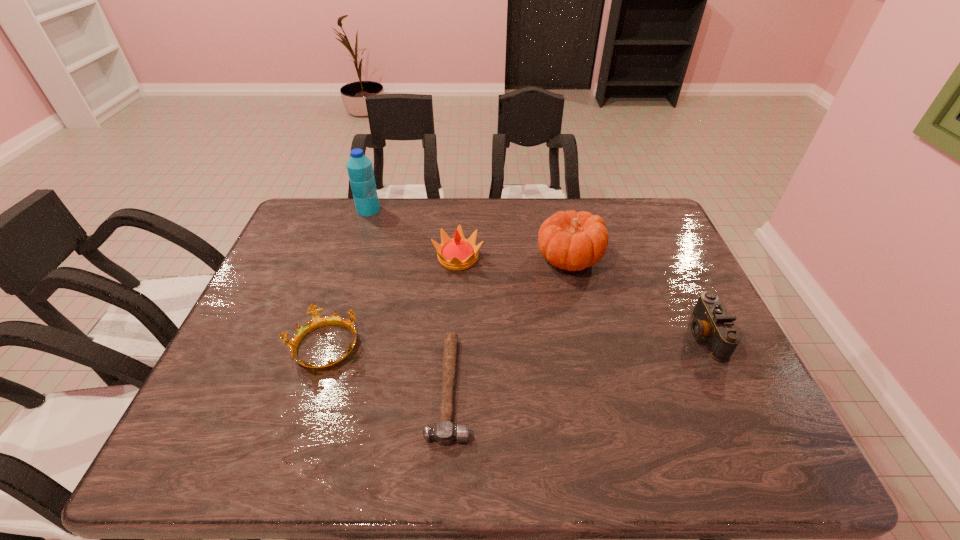
Locate an element on the screen. Image resolution: width=960 pixels, height=540 pixels. pumpkin that is at the far edge is located at coordinates (573, 241).

The height and width of the screenshot is (540, 960). I want to click on object at the near edge, so click(444, 432).

This screenshot has width=960, height=540. I want to click on object present at the left edge, so pyautogui.click(x=317, y=321).

Identify the location of object at the right edge. (711, 321).

Identify the location of vacant space at the far edge of the desktop. This screenshot has width=960, height=540. (477, 234).

Locate an element on the screen. This screenshot has height=540, width=960. vacant area at the near edge is located at coordinates (643, 460).

You are a GUI agent. You are given a task and a screenshot of the screen. Output one action in this format:
    pyautogui.click(x=<x>, y=<y>)
    Task: Click on the vacant space at the right edge of the desktop
    The width and height of the screenshot is (960, 540).
    Given the screenshot: What is the action you would take?
    pyautogui.click(x=700, y=371)

In the image, there is a desktop. At what (x,y) coordinates should I click in order to perform the action: click on vacant space at the near left corner. Please return your answer as a coordinate pair (x, y). Looking at the image, I should click on (209, 460).

In the image, there is a desktop. Where is `free space at the far right corner`? The image size is (960, 540). free space at the far right corner is located at coordinates (634, 239).

The width and height of the screenshot is (960, 540). In the image, there is a desktop. Find the location of `vacant space at the near right corner`. vacant space at the near right corner is located at coordinates (756, 455).